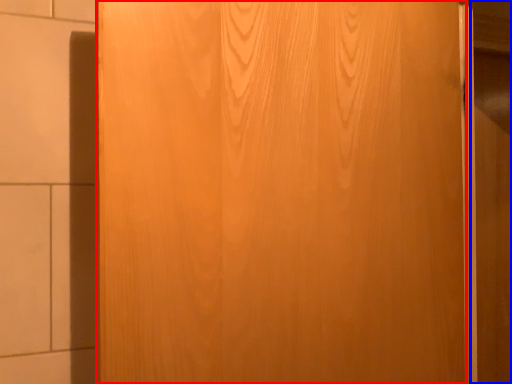
Question: Which object appears farthest to the camera in this image, door (highlighted by a red box) or barn door (highlighted by a blue box)?

Choices:
 (A) door
 (B) barn door

Answer: (B)